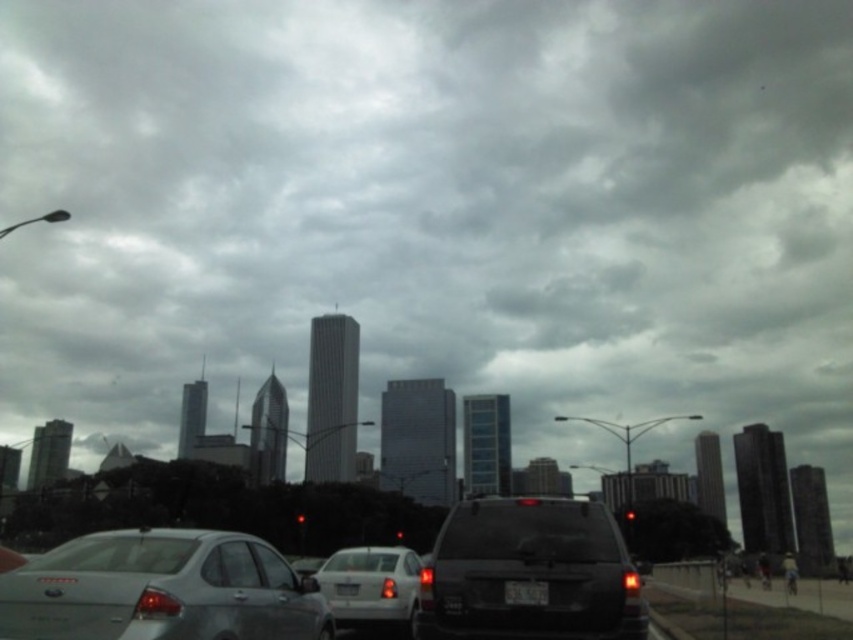
You are a driver approaching the intersection and notice both the black matte license plate at center and the red glass traffic light at center. Which object is narrower in width?

The black matte license plate at center is thinner than the red glass traffic light at center, so the black matte license plate at center is narrower in width.

You are a delivery driver needing to park your vehicle in a narrow space. The space is only wide enough for the satin silver sedan at lower left. Can your white matte sedan at center fit into this space?

The satin silver sedan at lower left is thinner than the white matte sedan at center. Therefore, the white matte sedan at center is wider and cannot fit into the space designed for the satin silver sedan at lower left.